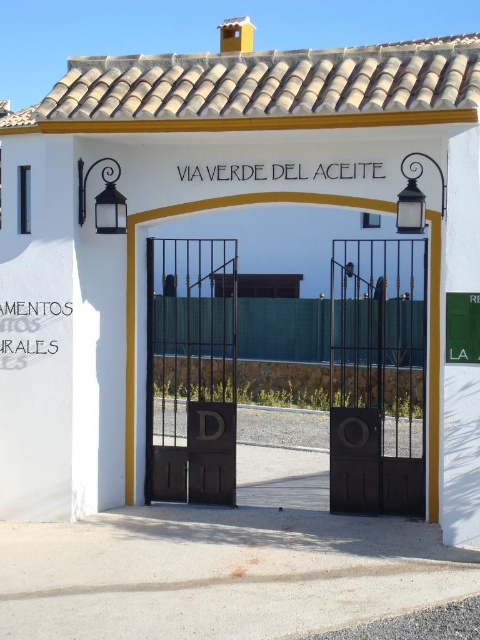
Which is more to the left, brown matte door at center or dark brown wrought iron gate at center?

Positioned to the left is dark brown wrought iron gate at center.

Can you confirm if brown matte door at center is smaller than dark brown wrought iron gate at center?

No.

This screenshot has height=640, width=480. What do you see at coordinates (377, 376) in the screenshot?
I see `brown matte door at center` at bounding box center [377, 376].

Find the location of `brown matte door at center`. brown matte door at center is located at coordinates (377, 376).

Is point (350, 353) more distant than point (156, 317)?

Yes, point (350, 353) is behind point (156, 317).

Does point (423, 355) lie in front of point (219, 362)?

Yes, point (423, 355) is closer to viewer.

This screenshot has width=480, height=640. What do you see at coordinates (377, 376) in the screenshot? I see `brown matte door at center` at bounding box center [377, 376].

Identify the location of brown matte door at center. This screenshot has width=480, height=640. (377, 376).

Which is in front, point (228, 257) or point (128, 225)?

Positioned in front is point (128, 225).

Who is taller, black metal gate at center or dark brown wrought iron gate at center?

black metal gate at center

The image size is (480, 640). Describe the element at coordinates (191, 371) in the screenshot. I see `black metal gate at center` at that location.

Find the location of a particular element. This screenshot has width=480, height=640. black metal gate at center is located at coordinates (191, 371).